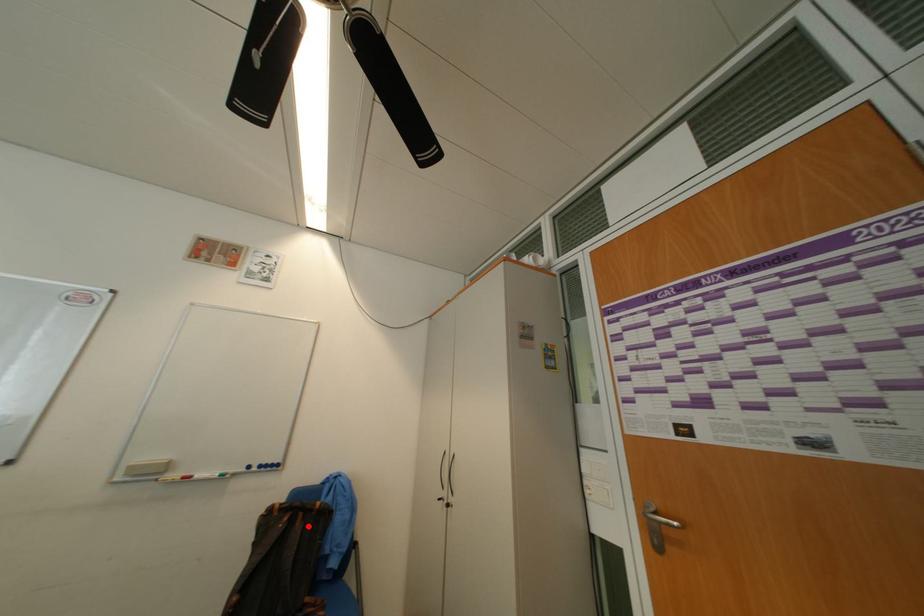
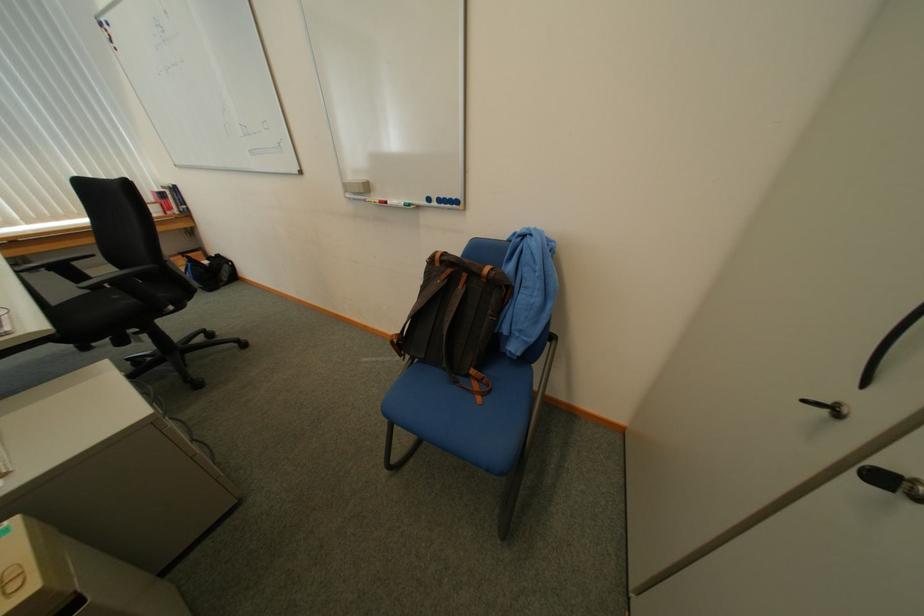
Where in the second image is the point corresponding to the highlighted location from the first image?

(469, 290)